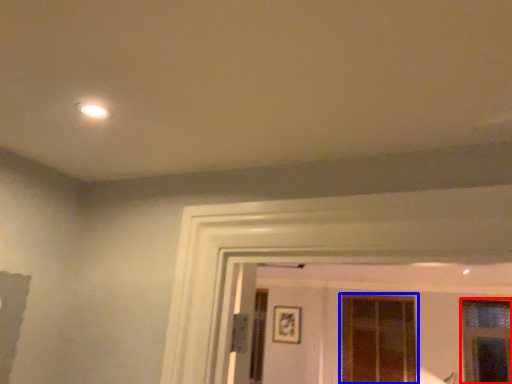
Question: Which point is closer to the camera, window (highlighted by a red box) or window (highlighted by a blue box)?

Choices:
 (A) window
 (B) window

Answer: (A)